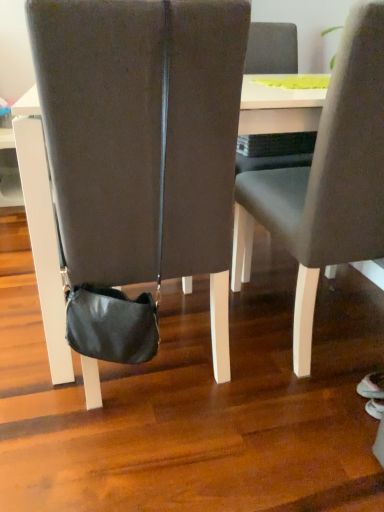
Question: Considering the positions of matte gray chair at center, the first chair from the right, and white glossy table at center in the image, is matte gray chair at center, the first chair from the right, wider or thinner than white glossy table at center?

Choices:
 (A) thin
 (B) wide

Answer: (A)

Question: Is matte gray chair at center, the first chair from the right, to the left or to the right of white glossy table at center in the image?

Choices:
 (A) left
 (B) right

Answer: (B)

Question: Considering the real-world distances, which object is farthest from the black leather bag at center, arranged as the first chair when viewed from the left?

Choices:
 (A) white glossy table at center
 (B) matte gray chair at center, the second chair positioned from the left

Answer: (B)

Question: Estimate the real-world distances between objects in this image. Which object is closer to the matte gray chair at center, the first chair from the right?

Choices:
 (A) black leather bag at center, the second chair in the right-to-left sequence
 (B) white glossy table at center

Answer: (B)